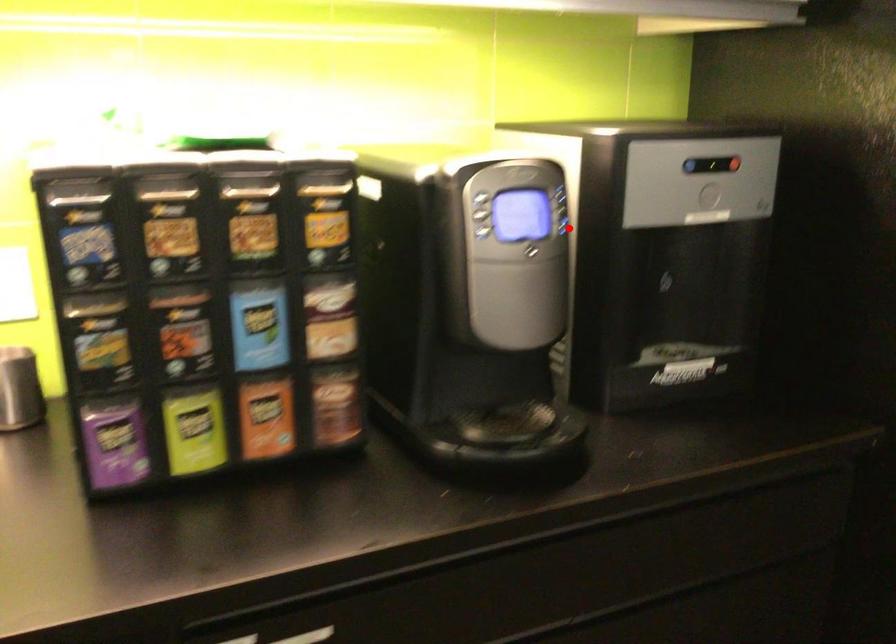
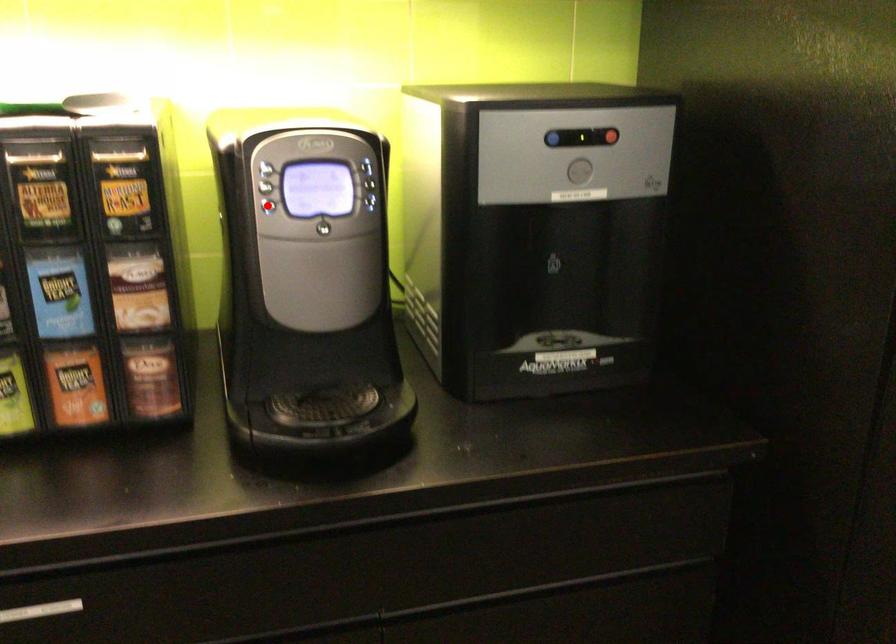
I am providing you with two images of the same scene from different viewpoints. A red point is marked on the first image and another point is marked on the second image. Is the red point in image1 aligned with the point shown in image2?

No